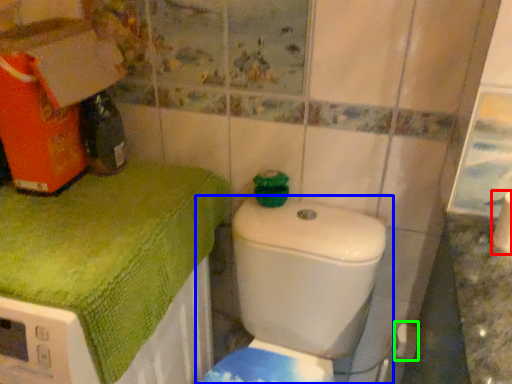
Question: Considering the real-world distances, which object is closest to toilet paper (highlighted by a red box)? toilet (highlighted by a blue box) or toilet paper (highlighted by a green box).

Choices:
 (A) toilet
 (B) toilet paper

Answer: (A)